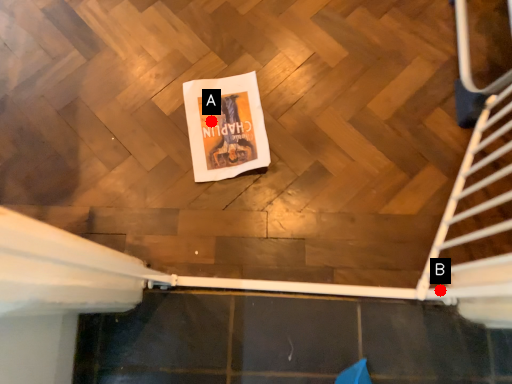
Question: Two points are circled on the image, labeled by A and B beside each circle. Which of the following is the farthest from the observer?

Choices:
 (A) A is further
 (B) B is further

Answer: (A)